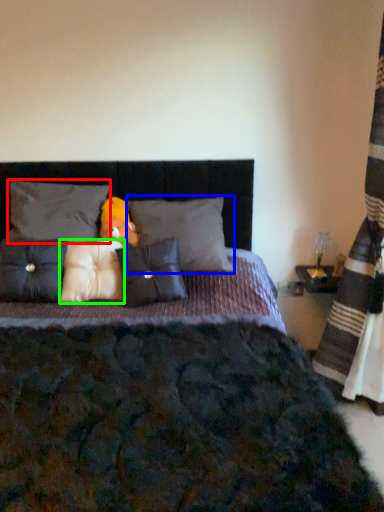
Question: Estimate the real-world distances between objects in this image. Which object is farther from pillow (highlighted by a red box), pillow (highlighted by a blue box) or pillow (highlighted by a green box)?

Choices:
 (A) pillow
 (B) pillow

Answer: (A)